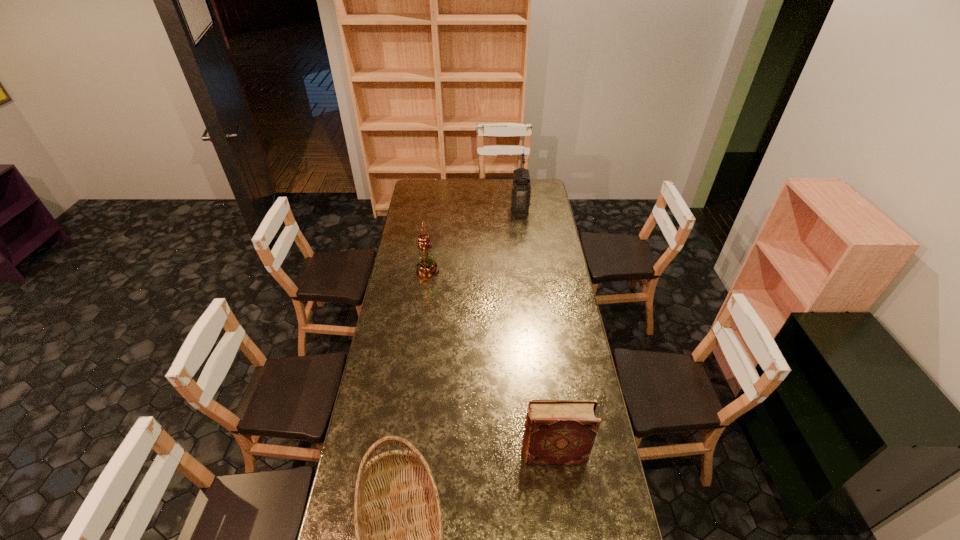
The width and height of the screenshot is (960, 540). I want to click on object that is at the left edge, so click(427, 268).

Find the location of `lantern present at the right edge`. lantern present at the right edge is located at coordinates (520, 187).

I want to click on hardback book that is at the right edge, so click(x=556, y=431).

The image size is (960, 540). Identify the location of vacant space at the left edge of the desktop. (353, 450).

The width and height of the screenshot is (960, 540). Find the location of `blank space at the right edge of the desktop`. blank space at the right edge of the desktop is located at coordinates (555, 222).

Locate an element on the screen. The height and width of the screenshot is (540, 960). free space at the far left corner of the desktop is located at coordinates (416, 187).

Locate an element on the screen. Image resolution: width=960 pixels, height=540 pixels. free point at the far right corner is located at coordinates (540, 188).

This screenshot has height=540, width=960. I want to click on free space between the oil lamp and the farthest object, so click(473, 240).

Find the location of a particular element. This screenshot has height=540, width=960. vacant space in between the lantern and the hardback book is located at coordinates (537, 331).

At what (x,y) coordinates should I click in order to perform the action: click on vacant area that lies between the farthest object and the hardback book. Please return your answer as a coordinate pair (x, y). The image size is (960, 540). Looking at the image, I should click on (537, 331).